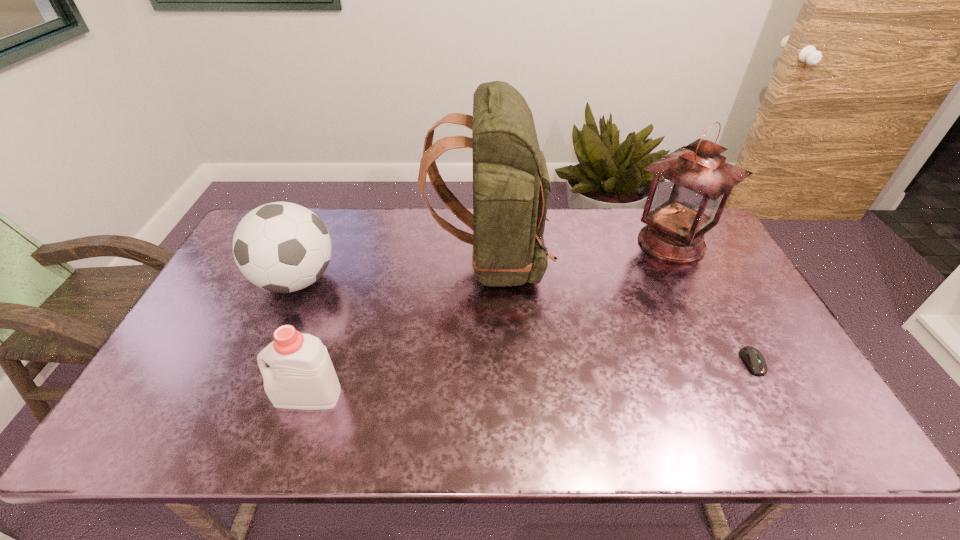
Find the location of a particular element. free space located 0.290m on the front of the oil lamp is located at coordinates pyautogui.click(x=726, y=351).

Find the location of a particular element. vacant region located 0.210m on the back of the soccer ball is located at coordinates (324, 216).

Locate an element on the screen. Image resolution: width=960 pixels, height=540 pixels. free region located 0.060m on the handle side of the nearest object is located at coordinates (251, 396).

Locate an element on the screen. The image size is (960, 540). vacant space located on the handle side of the nearest object is located at coordinates (204, 396).

Where is `free space located on the handle side of the nearest object`? The width and height of the screenshot is (960, 540). free space located on the handle side of the nearest object is located at coordinates (254, 396).

You are a GUI agent. You are given a task and a screenshot of the screen. Output one action in this format:
    pyautogui.click(x=<x>, y=<y>)
    Task: Click on the vacant region located 0.150m on the button of the second nearest object
    This screenshot has width=960, height=540.
    Given the screenshot: What is the action you would take?
    pyautogui.click(x=791, y=433)

Find the location of a particular element. Image resolution: width=960 pixels, height=540 pixels. backpack that is positioned at the far edge is located at coordinates (511, 187).

The image size is (960, 540). I want to click on oil lamp present at the far edge, so click(690, 188).

You are a GUI agent. You are given a task and a screenshot of the screen. Output one action in this format:
    pyautogui.click(x=<x>, y=<y>)
    Task: Click on the object that is positioned at the left edge
    The image size is (960, 540).
    Given the screenshot: What is the action you would take?
    pyautogui.click(x=281, y=247)

Where is `oil lamp positioned at the right edge`? This screenshot has width=960, height=540. oil lamp positioned at the right edge is located at coordinates (690, 188).